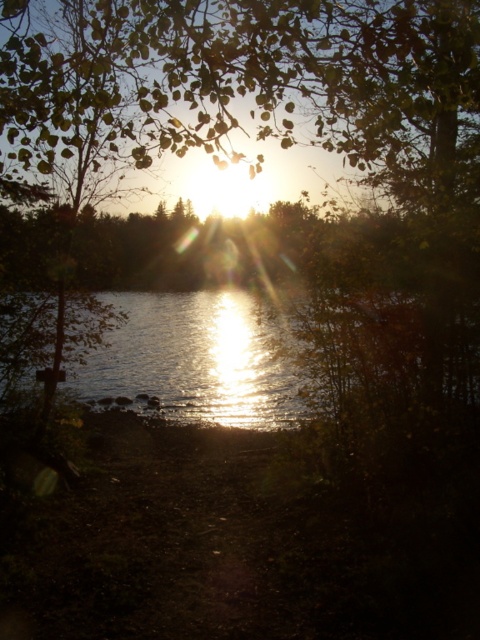
Question: Is green leafy tree at upper center in front of glistening reflective water at center?

Choices:
 (A) no
 (B) yes

Answer: (B)

Question: Is green leafy tree at upper center to the left of glistening reflective water at center from the viewer's perspective?

Choices:
 (A) yes
 (B) no

Answer: (A)

Question: Which point appears closest to the camera in this image?

Choices:
 (A) (204, 406)
 (B) (3, 106)

Answer: (B)

Question: Observing the image, what is the correct spatial positioning of green leafy tree at upper center in reference to glistening reflective water at center?

Choices:
 (A) right
 (B) left

Answer: (B)